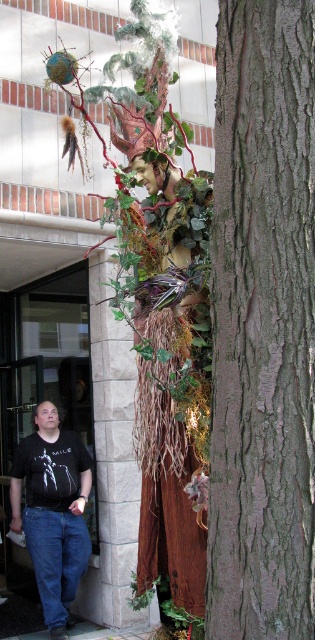
Question: Which point is farther to the camera?

Choices:
 (A) wooden statue at center
 (B) brown rough bark at right
 (C) black t-shirt at lower left

Answer: (C)

Question: Which of the following is the farthest from the observer?

Choices:
 (A) brown rough bark at right
 (B) black t-shirt at lower left

Answer: (B)

Question: Which object is closer to the camera taking this photo?

Choices:
 (A) wooden statue at center
 (B) black t-shirt at lower left
 (C) brown rough bark at right

Answer: (C)

Question: Does brown rough bark at right lie behind wooden statue at center?

Choices:
 (A) no
 (B) yes

Answer: (A)

Question: Does brown rough bark at right come behind wooden statue at center?

Choices:
 (A) yes
 (B) no

Answer: (B)

Question: Does brown rough bark at right come behind wooden statue at center?

Choices:
 (A) yes
 (B) no

Answer: (B)